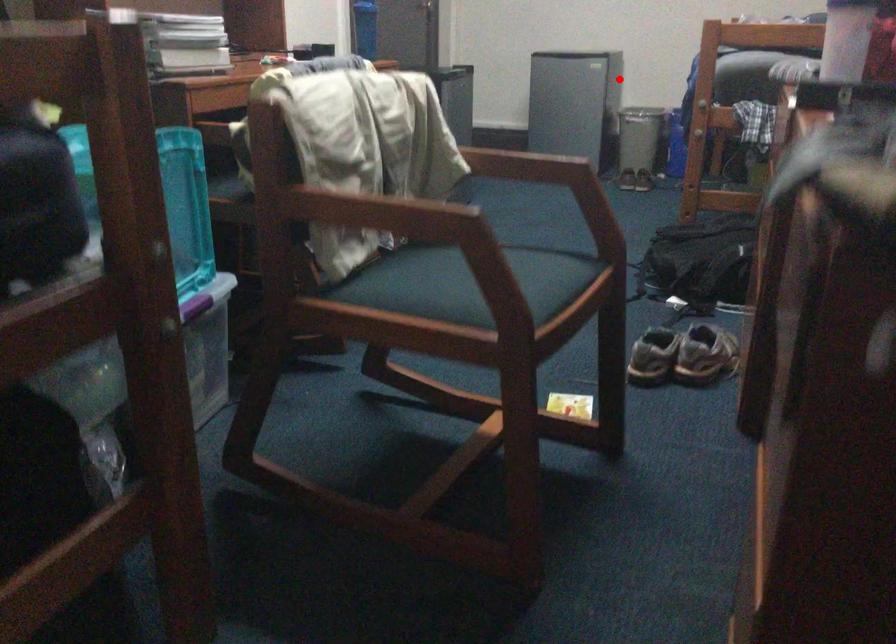
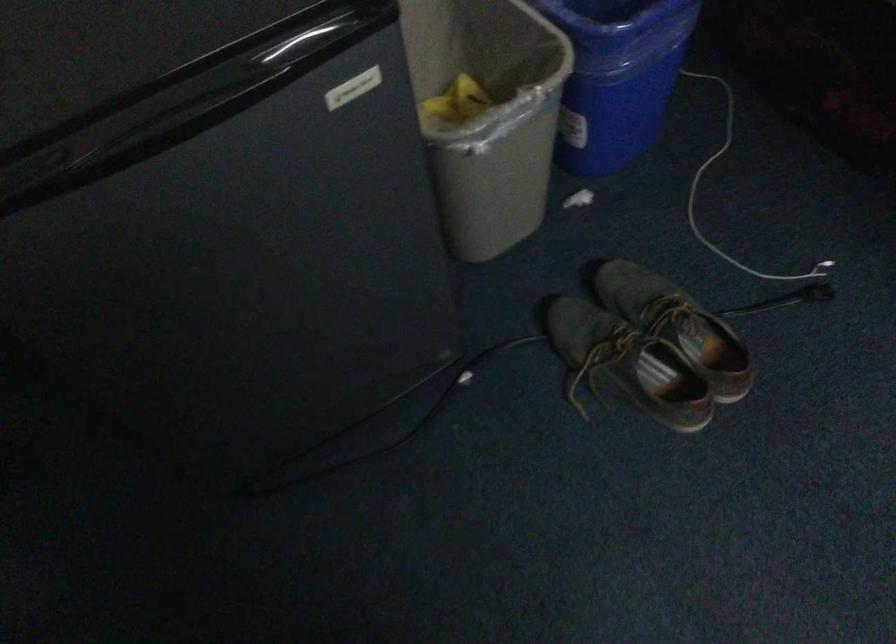
Locate, in the second image, the point that corresponds to the highlighted location in the first image.

(487, 115)